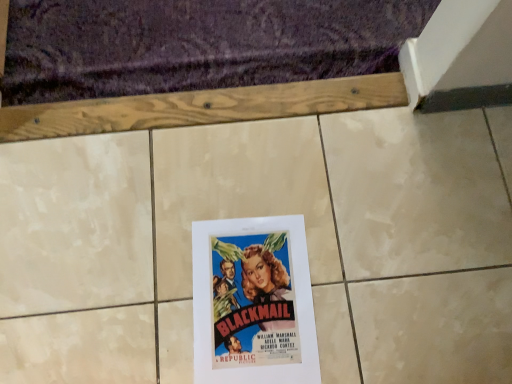
Locate an element on the screen. free point behind matte paper poster at center is located at coordinates (251, 172).